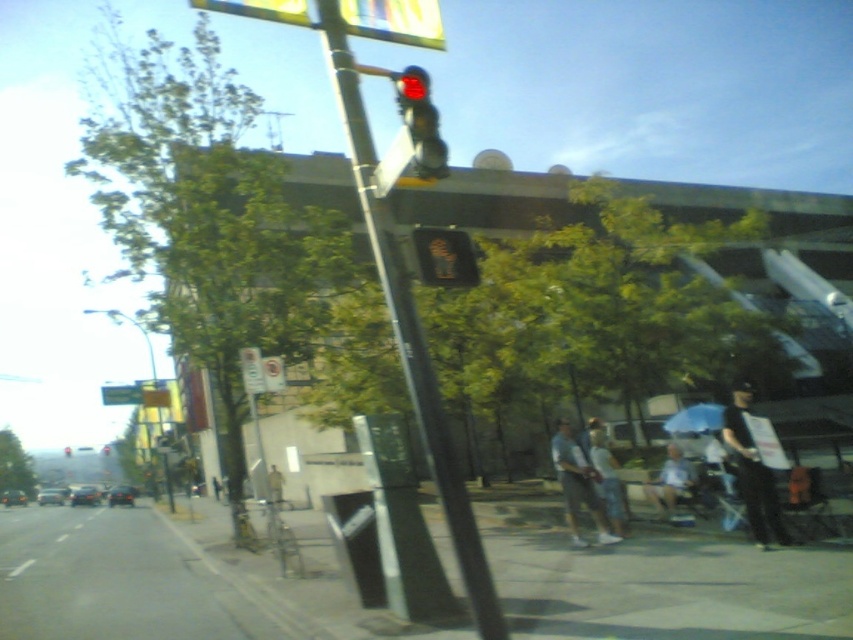
Does point (207, 577) lie in front of point (466, 236)?

No.

Who is more distant from viewer, (x=206, y=627) or (x=416, y=244)?

The point (x=206, y=627) is more distant.

The width and height of the screenshot is (853, 640). Find the location of `gray asphalt road at lower left`. gray asphalt road at lower left is located at coordinates pos(125,580).

What do you see at coordinates (276, 483) in the screenshot? I see `yellow fabric person at center` at bounding box center [276, 483].

Between point (274, 490) and point (102, 452), which one is positioned behind?

The point (102, 452) is more distant.

Find the location of a particular element. Image resolution: width=853 pixels, height=640 pixels. yellow fabric person at center is located at coordinates (276, 483).

Which is below, gray concrete sidewalk at lower center or red glass traffic light at center?

red glass traffic light at center is lower down.

From the picture: Can you confirm if gray concrete sidewalk at lower center is positioned below red glass traffic light at center?

Actually, gray concrete sidewalk at lower center is above red glass traffic light at center.

Is point (486, 548) positioned behind point (64, 456)?

That is False.

Identify the location of gray concrete sidewalk at lower center. Image resolution: width=853 pixels, height=640 pixels. (669, 589).